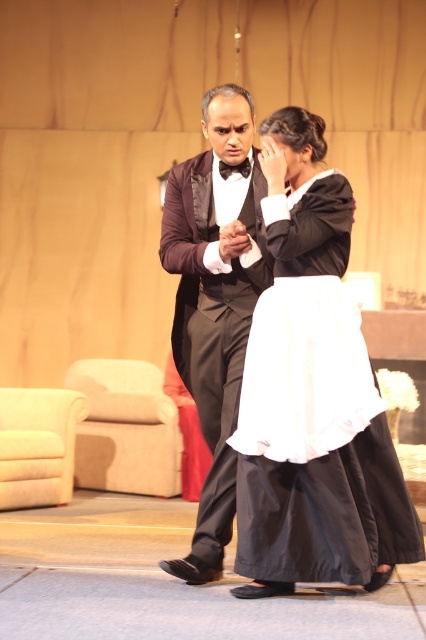
Question: Does shiny black tuxedo at center appear on the left side of black satin bow tie at center?

Choices:
 (A) no
 (B) yes

Answer: (B)

Question: Among these points, which one is farthest from the camera?

Choices:
 (A) (209, 524)
 (B) (249, 173)

Answer: (B)

Question: Is matte black dress at center wider than black satin bow tie at center?

Choices:
 (A) no
 (B) yes

Answer: (B)

Question: Which of the following is the closest to the observer?

Choices:
 (A) shiny black tuxedo at center
 (B) black satin bow tie at center

Answer: (A)

Question: Is shiny black tuxedo at center below black satin bow tie at center?

Choices:
 (A) no
 (B) yes

Answer: (B)

Question: Which object appears farthest from the camera in this image?

Choices:
 (A) matte black dress at center
 (B) shiny black tuxedo at center

Answer: (B)